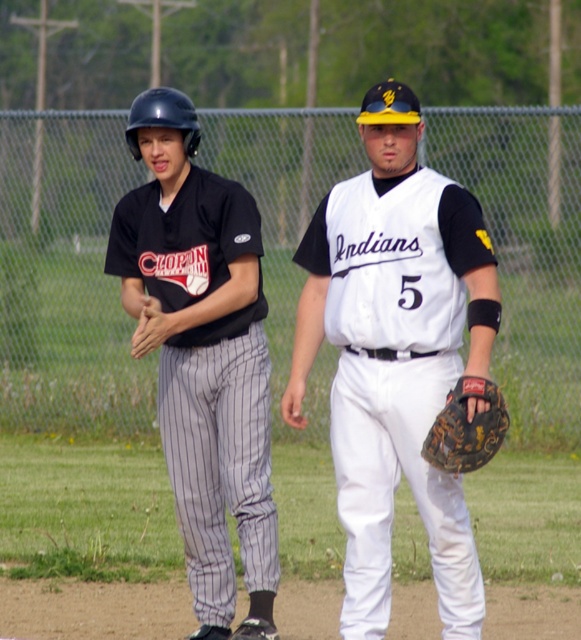
You are a photographer trying to capture the perfect shot of the baseball game. You want to focus on the matte black jersey at left and the white baseball uniform at right. Which player is closer to the point at coordinates [216,465]?

The matte black jersey at left is located at point [216,465], so it is closer to that point than the white baseball uniform at right.

You are a photographer trying to capture a clear shot of both the matte black helmet at left and the white matte jersey at center. Since you want to ensure both are visible, which object should you focus on first to account for their sizes?

The matte black helmet at left is larger than the white matte jersey at center, so you should focus on the matte black helmet at left first to ensure its details are captured clearly before adjusting for the smaller white matte jersey at center.